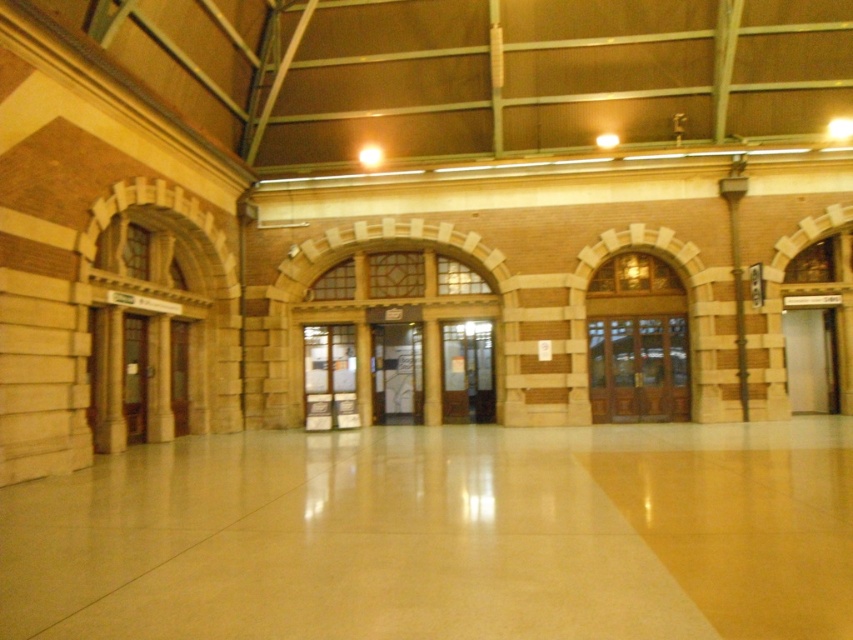
You are a visitor entering the train station and need to reach the ticket counter. You see a satin silver door at right and a wooden door at center. Which door is above the other?

The satin silver door at right is positioned over the wooden door at center, meaning it is above it.

Consider the image. You are standing at the point labeled point (308, 348) in the train station. You need to walk to the exit, which is located at the other end of the station. The station is 100 feet long. Can you reach the exit in 10 seconds if you walk at a speed of 3 feet per second?

The distance between point (308, 348) and the exit is 66.05 feet. Walking at 3 feet per second, it would take approximately 22 seconds to reach the exit. Since 22 seconds is longer than 10 seconds, you cannot reach the exit in the given time.

You are standing at the entrance of the building and want to locate the translucent glass door at center. According to the coordinates provided, where should you look to find it?

The translucent glass door at center is located at coordinates point (329, 378), so you should look towards the center area of the building to find it.